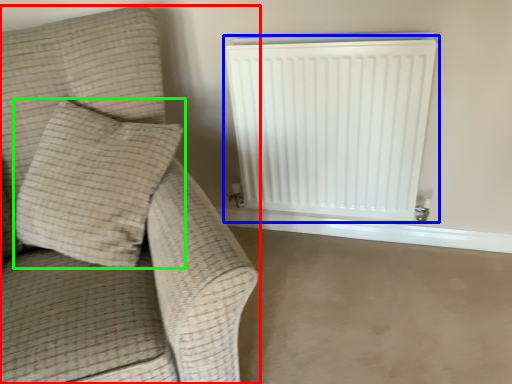
Question: Based on their relative distances, which object is nearer to furniture (highlighted by a red box)? Choose from radiator (highlighted by a blue box) and pillow (highlighted by a green box).

Choices:
 (A) radiator
 (B) pillow

Answer: (B)